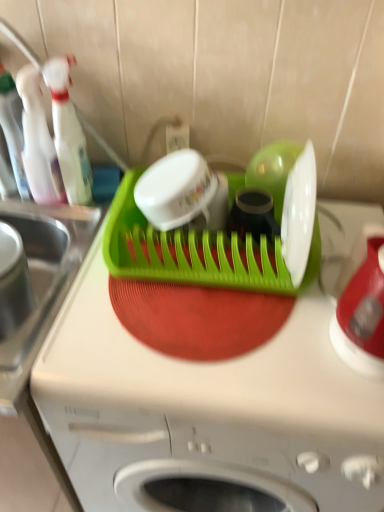
Image resolution: width=384 pixels, height=512 pixels. I want to click on vacant area to the left of red glossy kettle at right, placed as the 1th appliance when sorted from right to left, so click(278, 369).